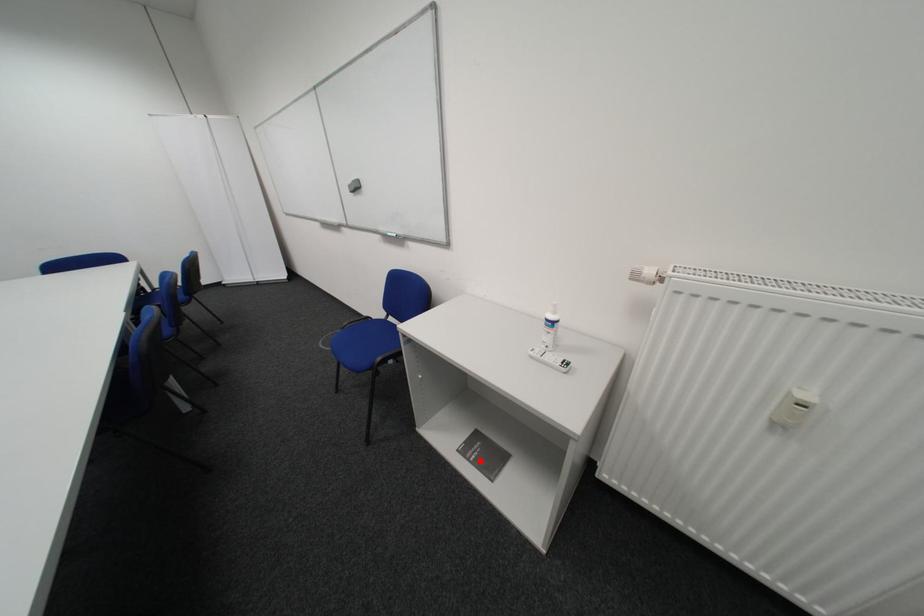
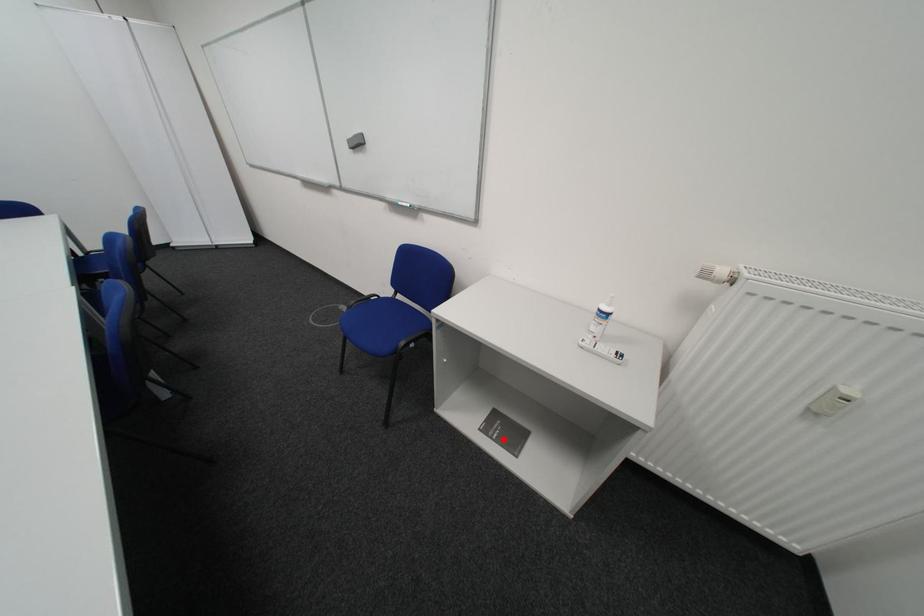
I am providing you with two images of the same scene from different viewpoints. A red point is marked on the first image and another point is marked on the second image. Do the highlighted points in image1 and image2 indicate the same real-world spot?

Yes